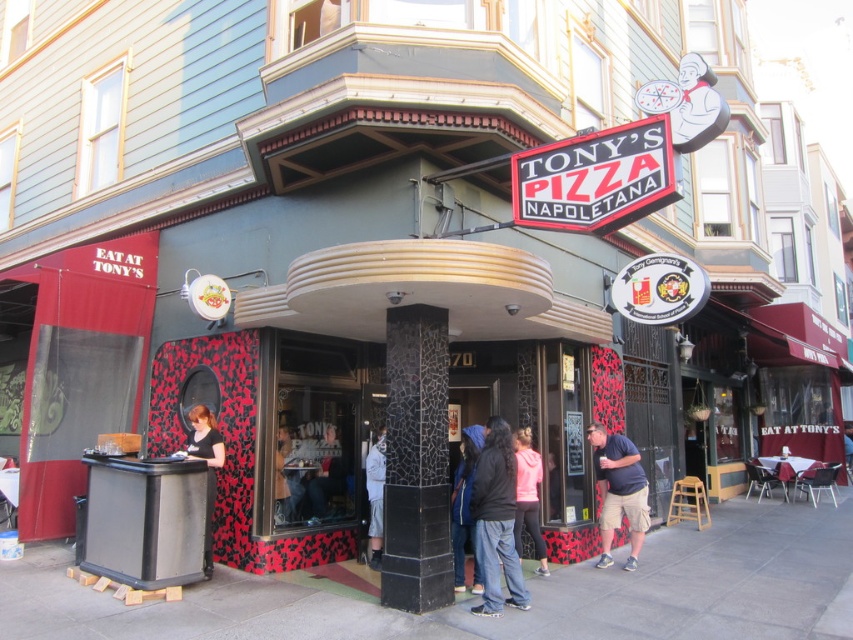
Who is higher up, denim pants at center or light brown wooden stool at lower right?

denim pants at center

Does point (479, 548) come closer to viewer compared to point (694, 486)?

Yes, point (479, 548) is closer to viewer.

This screenshot has width=853, height=640. Find the location of `denim pants at center`. denim pants at center is located at coordinates (496, 520).

Based on the photo, does matte black shirt at lower left appear on the right side of white cotton shirt at center?

No, matte black shirt at lower left is not to the right of white cotton shirt at center.

Does matte black shirt at lower left have a greater height compared to white cotton shirt at center?

Indeed, matte black shirt at lower left has a greater height compared to white cotton shirt at center.

Locate an element on the screen. The image size is (853, 640). matte black shirt at lower left is located at coordinates (206, 464).

Between denim pants at center and pink matte jacket at center, which one is positioned higher?

denim pants at center is above.

Measure the distance from denim pants at center to pink matte jacket at center.

The distance of denim pants at center from pink matte jacket at center is 32.83 inches.

Find the location of `denim pants at center`. denim pants at center is located at coordinates (496, 520).